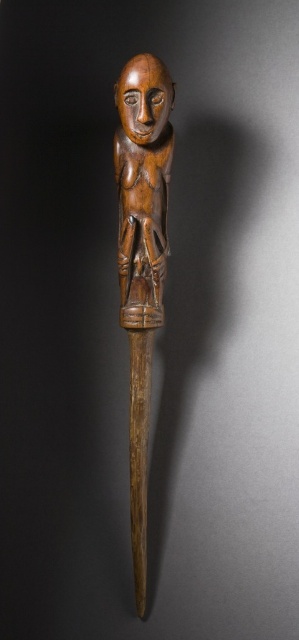
Which object is positioned lower in the image, the wooden carving at center or the wooden figurine at center?

The wooden carving at center is positioned lower than the wooden figurine at center.

You are an artist trying to fit both the wooden carving at center and the wooden figurine at center into a display case that can only accommodate items up to the width of the wider object. Which object determines the maximum width the case must have?

The wooden figurine at center determines the maximum width the case must have because its width is greater than the wooden carving at center.